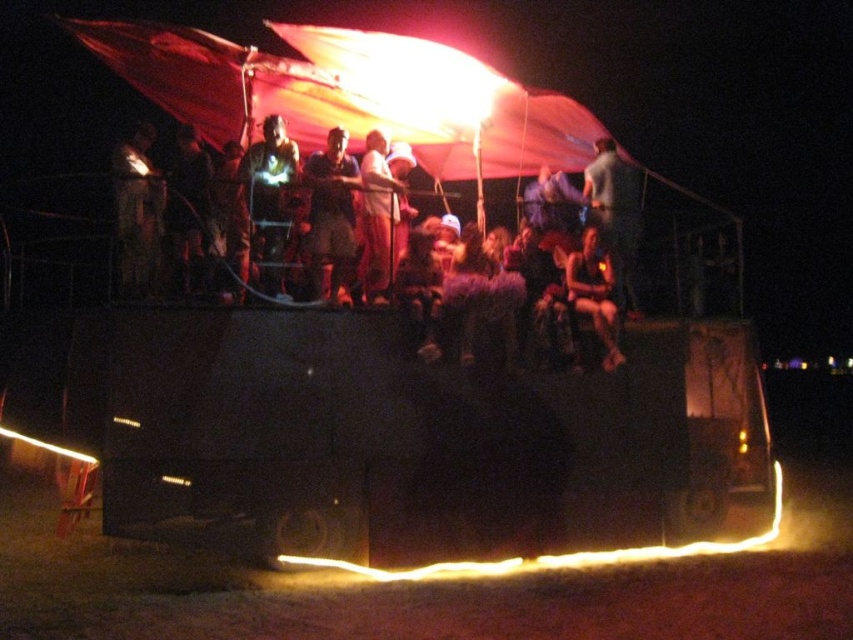
You are a photographer trying to capture the scene of the nighttime vehicle with people on top. You notice a dark gray fabric at upper right in the image. Where exactly is this fabric located in terms of coordinates?

The dark gray fabric at upper right is located at point [614,216].

You are standing on the roof of the vehicle and looking around. There is a point at coordinate (350, 93). What is this point located on?

The point at coordinate (350, 93) is located on the translucent fabric canopy at upper center.